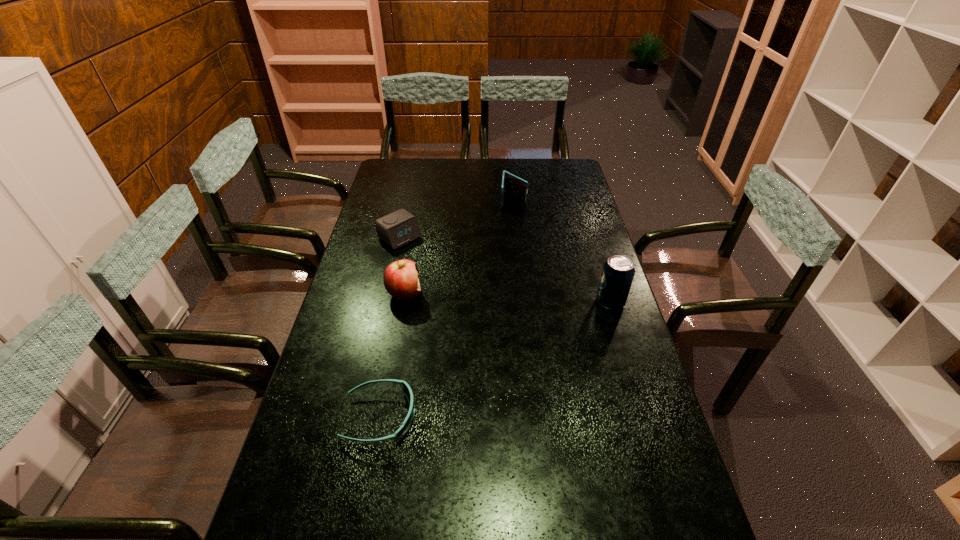
Locate an element on the screen. Image resolution: width=960 pixels, height=540 pixels. the shortest object is located at coordinates (406, 389).

Locate an element on the screen. The height and width of the screenshot is (540, 960). the nearest object is located at coordinates (406, 389).

Where is `soda can`? The height and width of the screenshot is (540, 960). soda can is located at coordinates (618, 272).

Where is `the tallest object`? This screenshot has height=540, width=960. the tallest object is located at coordinates (618, 272).

Image resolution: width=960 pixels, height=540 pixels. In order to click on wallet in this screenshot , I will do `click(512, 186)`.

Locate an element on the screen. The width and height of the screenshot is (960, 540). the second object from right to left is located at coordinates (512, 186).

The image size is (960, 540). I want to click on apple, so click(x=400, y=278).

This screenshot has height=540, width=960. Identify the location of the fourth tallest object. (396, 229).

You are a GUI agent. You are given a task and a screenshot of the screen. Output one action in this format:
    pyautogui.click(x=<x>, y=<y>)
    Task: Click on the fourth nearest object
    Image resolution: width=960 pixels, height=540 pixels.
    Given the screenshot: What is the action you would take?
    pyautogui.click(x=396, y=229)

Locate an element on the screen. The width and height of the screenshot is (960, 540). vacant space situated 0.260m on the front-facing side of the shortest object is located at coordinates (517, 417).